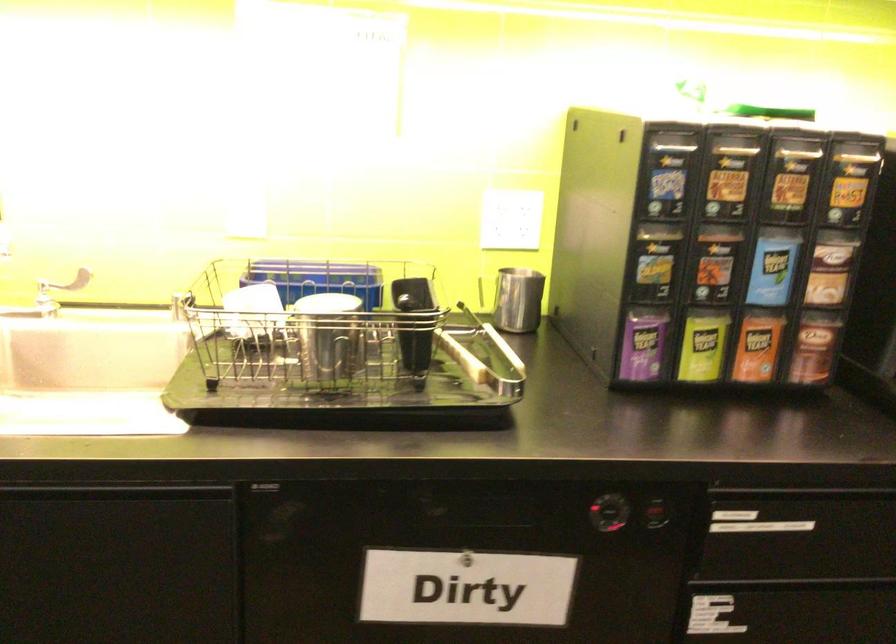
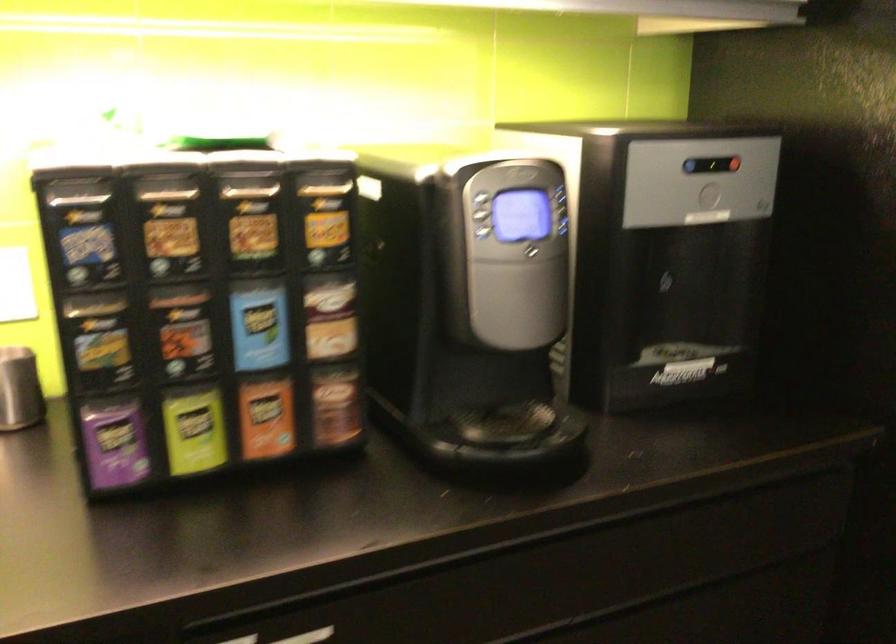
Where in the second image is the point corresponding to point (797, 526) from the first image?

(308, 636)